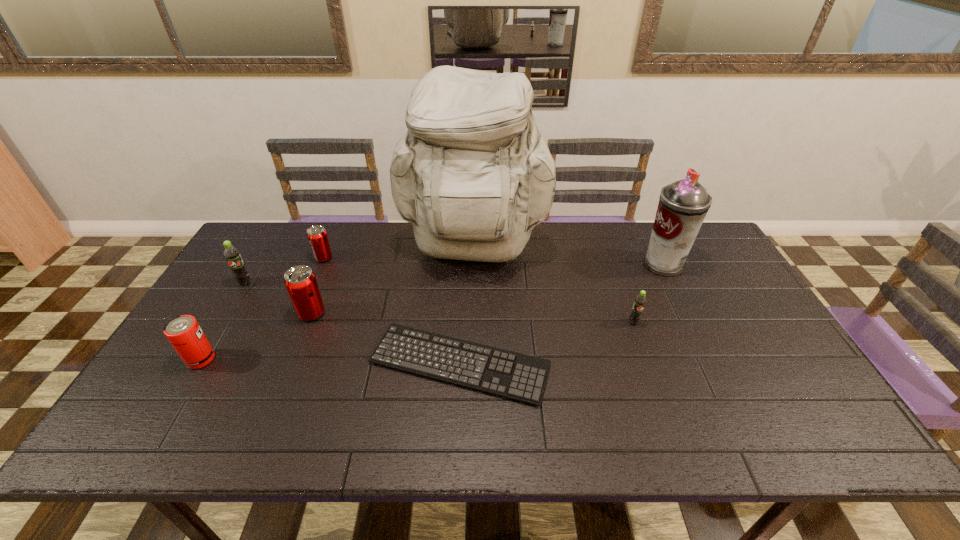
Locate an element on the screen. The image size is (960, 540). the tallest object is located at coordinates (473, 175).

The image size is (960, 540). Find the location of `gray aerosol can`. gray aerosol can is located at coordinates (683, 205).

The image size is (960, 540). What are the coordinates of `the second tallest object` in the screenshot? It's located at (683, 205).

Locate an element on the screen. the left green soda is located at coordinates (232, 255).

This screenshot has width=960, height=540. I want to click on the bigger green soda, so click(x=232, y=255).

Where is `the nearer red soda can`? the nearer red soda can is located at coordinates (300, 281).

The image size is (960, 540). I want to click on can, so click(184, 333).

Find the location of `the smaller red soda can`. the smaller red soda can is located at coordinates (317, 236).

In order to click on the farthest soda in this screenshot , I will do `click(317, 236)`.

Where is `the rightmost soda`? This screenshot has height=540, width=960. the rightmost soda is located at coordinates (640, 301).